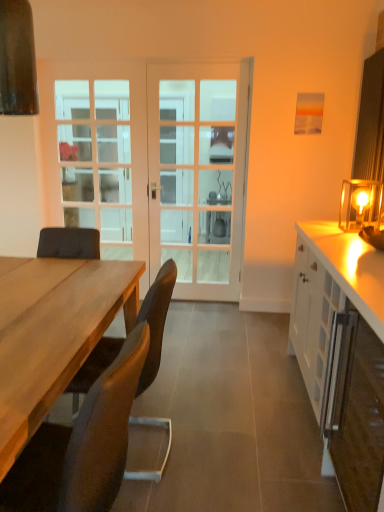
Find the location of a particular element. The width and height of the screenshot is (384, 512). white glossy cabinet at right, positioned as the second cabinetry in front-to-back order is located at coordinates (350, 267).

The width and height of the screenshot is (384, 512). What do you see at coordinates (81, 445) in the screenshot? I see `brown leather chair at lower left, acting as the 2th chair starting from the back` at bounding box center [81, 445].

How much space does brown leather chair at lower left, placed as the 1th chair when sorted from front to back, occupy horizontally?

The width of brown leather chair at lower left, placed as the 1th chair when sorted from front to back, is 23.63 inches.

Measure the distance between brown leather chair at lower left, which is the second chair in front-to-back order, and camera.

A distance of 1.51 meters exists between brown leather chair at lower left, which is the second chair in front-to-back order, and camera.

Identify the location of clear glass door at center. (95, 155).

What do you see at coordinates (95, 155) in the screenshot? This screenshot has width=384, height=512. I see `clear glass door at center` at bounding box center [95, 155].

The image size is (384, 512). What do you see at coordinates (161, 168) in the screenshot? I see `white glass door at center` at bounding box center [161, 168].

At what (x,y) coordinates should I click in order to perform the action: click on white glass door at center. Please return your answer as a coordinate pair (x, y). Looking at the image, I should click on (161, 168).

Locate an element on the screen. This screenshot has height=512, width=384. white glossy cabinet at right, which is counted as the 1th cabinetry, starting from the back is located at coordinates (350, 267).

Is white glass screen door at center behind brown leather chair at lower left, acting as the 2th chair starting from the back?

Yes, white glass screen door at center is behind brown leather chair at lower left, acting as the 2th chair starting from the back.

Does point (239, 255) come closer to viewer compared to point (93, 414)?

No, (239, 255) is behind (93, 414).

From the image's perspective, is white glass screen door at center below brown leather chair at lower left, placed as the 1th chair when sorted from front to back?

No.

Is white glass screen door at center looking in the opposite direction of brown leather chair at lower left, acting as the 2th chair starting from the back?

No, brown leather chair at lower left, acting as the 2th chair starting from the back, is not at the back of white glass screen door at center.

Is white glossy cabinet at right, positioned as the second cabinetry in front-to-back order, outside of brown leather chair at lower left, which is the second chair in front-to-back order?

Yes, white glossy cabinet at right, positioned as the second cabinetry in front-to-back order, is outside of brown leather chair at lower left, which is the second chair in front-to-back order.

Would you say white glossy cabinet at right, positioned as the second cabinetry in front-to-back order, is to the left or to the right of brown leather chair at lower left, which is the second chair in front-to-back order, in the picture?

Based on their positions, white glossy cabinet at right, positioned as the second cabinetry in front-to-back order, is located to the right of brown leather chair at lower left, which is the second chair in front-to-back order.

Identify the location of cabinetry behind the brown leather chair at lower left, which is the second chair in front-to-back order. (350, 267).

Is white glossy cabinet at right, positioned as the second cabinetry in front-to-back order, bigger than brown leather chair at lower left, the first chair positioned from the back?

Yes, white glossy cabinet at right, positioned as the second cabinetry in front-to-back order, is bigger than brown leather chair at lower left, the first chair positioned from the back.

Is white glass screen door at center smaller than white glossy cabinet at right, placed as the 2th cabinetry when sorted from back to front?

Yes.

Is white glass screen door at center next to white glossy cabinet at right, placed as the 2th cabinetry when sorted from back to front, and touching it?

No, white glass screen door at center is not with white glossy cabinet at right, placed as the 2th cabinetry when sorted from back to front.

Is white glass screen door at center facing away from white glossy cabinet at right, placed as the 2th cabinetry when sorted from back to front?

No, white glass screen door at center's orientation is not away from white glossy cabinet at right, placed as the 2th cabinetry when sorted from back to front.

From a real-world perspective, which is physically below, brown leather chair at lower left, placed as the 1th chair when sorted from front to back, or white glossy cabinet at right, the first cabinetry positioned from the front?

white glossy cabinet at right, the first cabinetry positioned from the front, is physically lower.

Is point (66, 470) closer to camera compared to point (363, 444)?

Yes, point (66, 470) is closer to viewer.

Considering the positions of objects brown leather chair at lower left, placed as the 1th chair when sorted from front to back, and white glossy cabinet at right, the first cabinetry positioned from the front, in the image provided, who is more to the right, brown leather chair at lower left, placed as the 1th chair when sorted from front to back, or white glossy cabinet at right, the first cabinetry positioned from the front,?

white glossy cabinet at right, the first cabinetry positioned from the front, is more to the right.

Which is in front, brown leather chair at lower left, placed as the 1th chair when sorted from front to back, or white glossy cabinet at right, placed as the 2th cabinetry when sorted from back to front?

brown leather chair at lower left, placed as the 1th chair when sorted from front to back.

From the picture: From a real-world perspective, which object rests below the other?

From a 3D spatial view, white glass screen door at center is below.

How different are the orientations of white glass door at center and white glass screen door at center in degrees?

They differ by 0.00146 degrees in their facing directions.

Between white glass door at center and white glass screen door at center, which one appears on the left side from the viewer's perspective?

From the viewer's perspective, white glass door at center appears more on the left side.

The height and width of the screenshot is (512, 384). I want to click on screen door located on the right of white glass door at center, so click(x=197, y=175).

From a real-world perspective, is clear glass door at center on top of matte brown exhaust hood at upper left?

No.

The width and height of the screenshot is (384, 512). What are the coordinates of `exhaust hood above the clear glass door at center (from the image's perspective)` in the screenshot? It's located at (17, 59).

Is clear glass door at center far from matte brown exhaust hood at upper left?

Yes, clear glass door at center and matte brown exhaust hood at upper left are located far from each other.

Is matte brown exhaust hood at upper left at the right side of white glossy cabinet at right, positioned as the second cabinetry in front-to-back order?

Incorrect, matte brown exhaust hood at upper left is not on the right side of white glossy cabinet at right, positioned as the second cabinetry in front-to-back order.

From a real-world perspective, which object rests below the other?

white glossy cabinet at right, positioned as the second cabinetry in front-to-back order.

Is matte brown exhaust hood at upper left completely or partially outside of white glossy cabinet at right, positioned as the second cabinetry in front-to-back order?

matte brown exhaust hood at upper left is positioned outside white glossy cabinet at right, positioned as the second cabinetry in front-to-back order.

Considering the sizes of objects matte brown exhaust hood at upper left and white glossy cabinet at right, which is counted as the 1th cabinetry, starting from the back, in the image provided, who is thinner, matte brown exhaust hood at upper left or white glossy cabinet at right, which is counted as the 1th cabinetry, starting from the back,?

Thinner between the two is matte brown exhaust hood at upper left.

Locate an element on the screen. screen door lying behind the brown leather chair at lower left, acting as the 2th chair starting from the back is located at coordinates click(197, 175).

The image size is (384, 512). Find the location of `chair that appears below the white glossy cabinet at right, which is counted as the 1th cabinetry, starting from the back (from a real-world perspective)`. chair that appears below the white glossy cabinet at right, which is counted as the 1th cabinetry, starting from the back (from a real-world perspective) is located at coordinates (156, 320).

Looking at the image, which one is located further to white glossy cabinet at right, which is counted as the 1th cabinetry, starting from the back, white glass door at center or matte brown exhaust hood at upper left?

white glass door at center is further to white glossy cabinet at right, which is counted as the 1th cabinetry, starting from the back.

Estimate the real-world distances between objects in this image. Which object is closer to brown leather chair at lower left, which is the second chair in front-to-back order, matte brown exhaust hood at upper left or matte glass table lamp at right?

matte brown exhaust hood at upper left is positioned closer to the anchor brown leather chair at lower left, which is the second chair in front-to-back order.

Consider the image. Which object lies further to the anchor point white glass screen door at center, matte glass table lamp at right or brown leather chair at lower left, placed as the 1th chair when sorted from front to back?

brown leather chair at lower left, placed as the 1th chair when sorted from front to back, is positioned further to the anchor white glass screen door at center.

Estimate the real-world distances between objects in this image. Which object is closer to brown leather chair at lower left, the first chair positioned from the back, white glass door at center or matte brown exhaust hood at upper left?

matte brown exhaust hood at upper left lies closer to brown leather chair at lower left, the first chair positioned from the back, than the other object.

Considering their positions, is white glossy cabinet at right, placed as the 2th cabinetry when sorted from back to front, positioned further to clear glass door at center than brown leather chair at lower left, the first chair positioned from the back?

white glossy cabinet at right, placed as the 2th cabinetry when sorted from back to front, is further to clear glass door at center.

Considering their positions, is clear glass door at center positioned closer to brown leather chair at lower left, which is the second chair in front-to-back order, than matte glass table lamp at right?

matte glass table lamp at right is positioned closer to the anchor brown leather chair at lower left, which is the second chair in front-to-back order.

From the image, which object appears to be nearer to brown leather chair at lower left, the first chair positioned from the back, white glossy cabinet at right, the first cabinetry positioned from the front, or matte brown exhaust hood at upper left?

The object closer to brown leather chair at lower left, the first chair positioned from the back, is white glossy cabinet at right, the first cabinetry positioned from the front.

From the image, which object appears to be farther from clear glass door at center, white glossy cabinet at right, which is counted as the 1th cabinetry, starting from the back, or brown leather chair at lower left, the first chair positioned from the back?

The object further to clear glass door at center is white glossy cabinet at right, which is counted as the 1th cabinetry, starting from the back.

I want to click on exhaust hood located between brown leather chair at lower left, which is the second chair in front-to-back order, and white glass door at center in the depth direction, so click(17, 59).

The image size is (384, 512). I want to click on door situated between clear glass door at center and matte glass table lamp at right from left to right, so 161,168.

Identify the location of exhaust hood between clear glass door at center and matte glass table lamp at right. (17, 59).

At what (x,y) coordinates should I click in order to perform the action: click on door between brown leather chair at lower left, acting as the 2th chair starting from the back, and white glass screen door at center in the front-back direction. Please return your answer as a coordinate pair (x, y). This screenshot has height=512, width=384. Looking at the image, I should click on (161, 168).